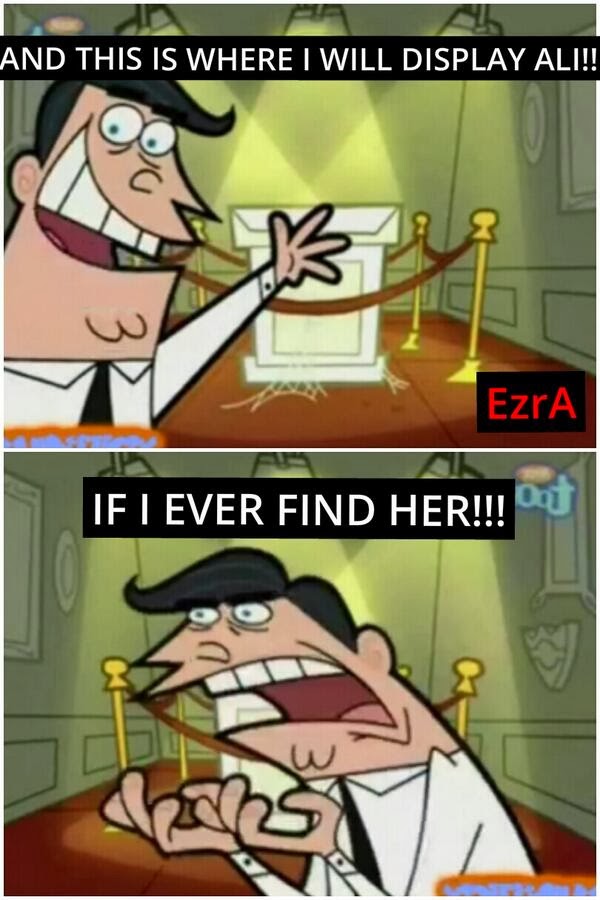
At what (x,y) coordinates should I click in order to perform the action: click on cobwebs. Please return your answer as a coordinate pair (x, y). Looking at the image, I should click on (292, 389), (395, 381).